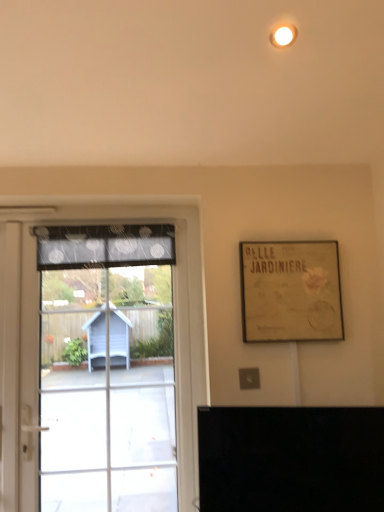
Question: From a real-world perspective, relative to black glossy tv at lower center, is gold textured paper at upper right vertically above or below?

Choices:
 (A) above
 (B) below

Answer: (A)

Question: Looking at their shapes, would you say gold textured paper at upper right is wider or thinner than black glossy tv at lower center?

Choices:
 (A) wide
 (B) thin

Answer: (B)

Question: Which is farther from the gold textured paper at upper right?

Choices:
 (A) transparent glass door at left
 (B) dark gray sheer curtain at left
 (C) black glossy tv at lower center

Answer: (B)

Question: Based on their relative distances, which object is nearer to the transparent glass door at left?

Choices:
 (A) gold textured paper at upper right
 (B) black glossy tv at lower center
 (C) dark gray sheer curtain at left

Answer: (C)